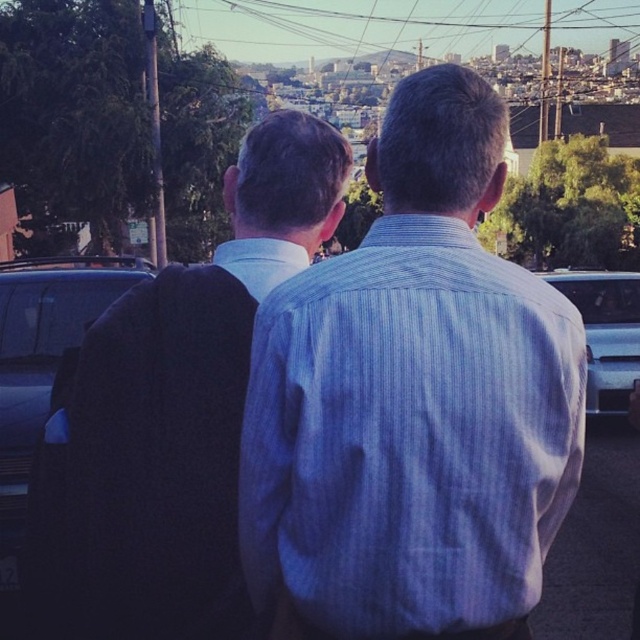
Question: Which point is closer to the camera?

Choices:
 (A) (356, 349)
 (B) (67, 608)
 (C) (609, 342)

Answer: (A)

Question: Considering the real-world distances, which object is closest to the shiny black car at left?

Choices:
 (A) satin silver car at right
 (B) dark blue sweater at left

Answer: (A)

Question: Where is dark blue sweater at left located in relation to shiny black car at left in the image?

Choices:
 (A) right
 (B) left

Answer: (A)

Question: Does shiny black car at left appear on the right side of satin silver car at right?

Choices:
 (A) yes
 (B) no

Answer: (B)

Question: In this image, where is blue striped shirt at center located relative to shiny black car at left?

Choices:
 (A) below
 (B) above

Answer: (A)

Question: Which object is closer to the camera taking this photo?

Choices:
 (A) shiny black car at left
 (B) blue striped shirt at center
 (C) satin silver car at right
 (D) dark blue sweater at left

Answer: (B)